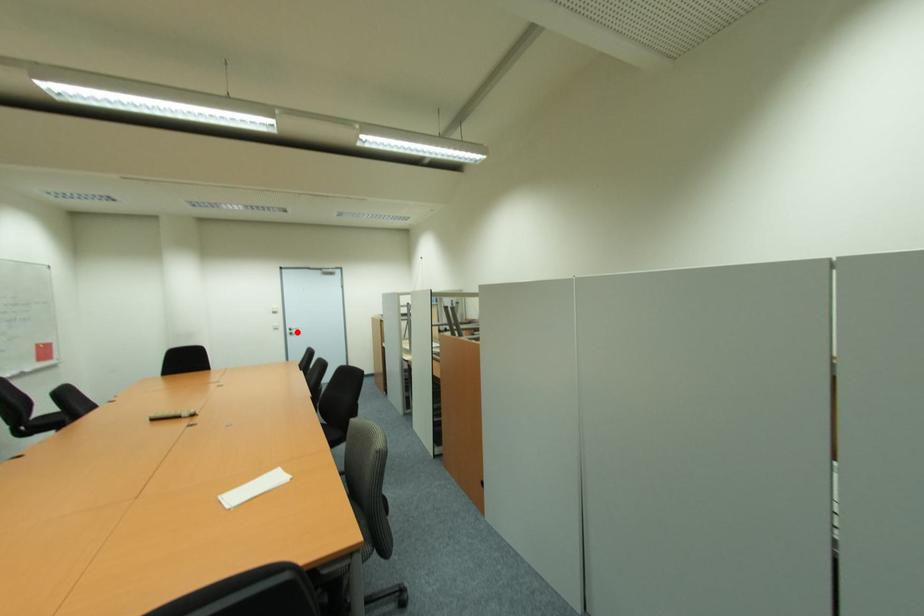
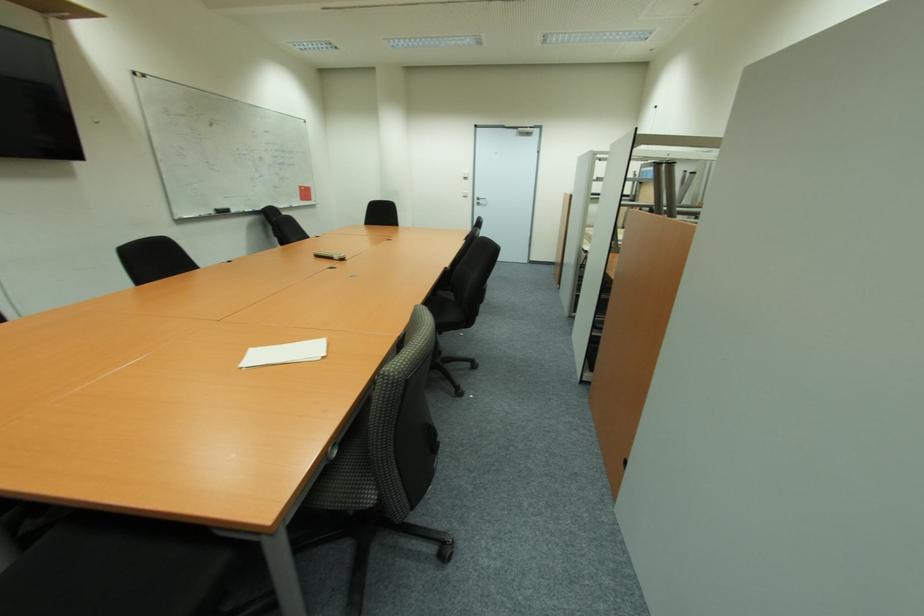
Where in the second image is the point corresponding to the highlighted location from the first image?

(483, 203)